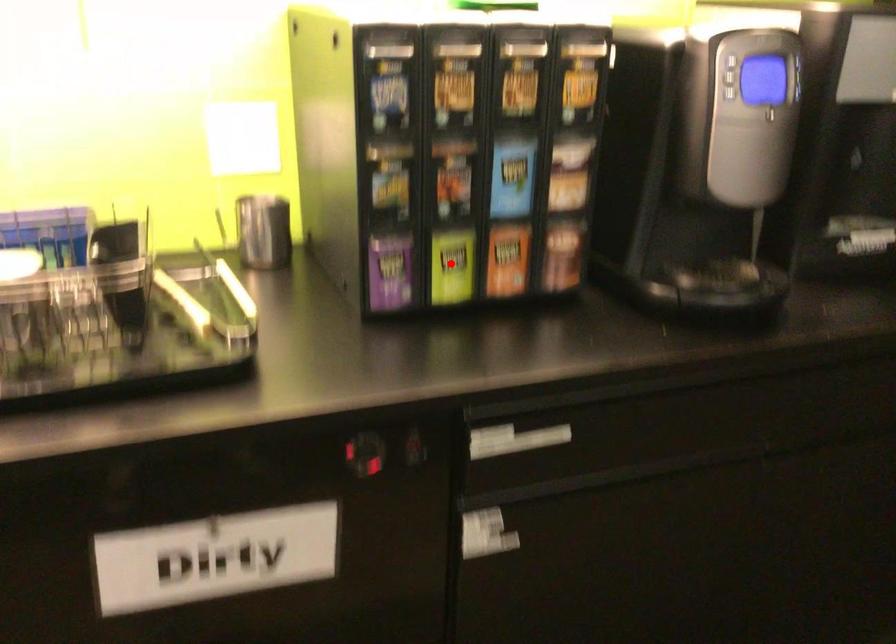
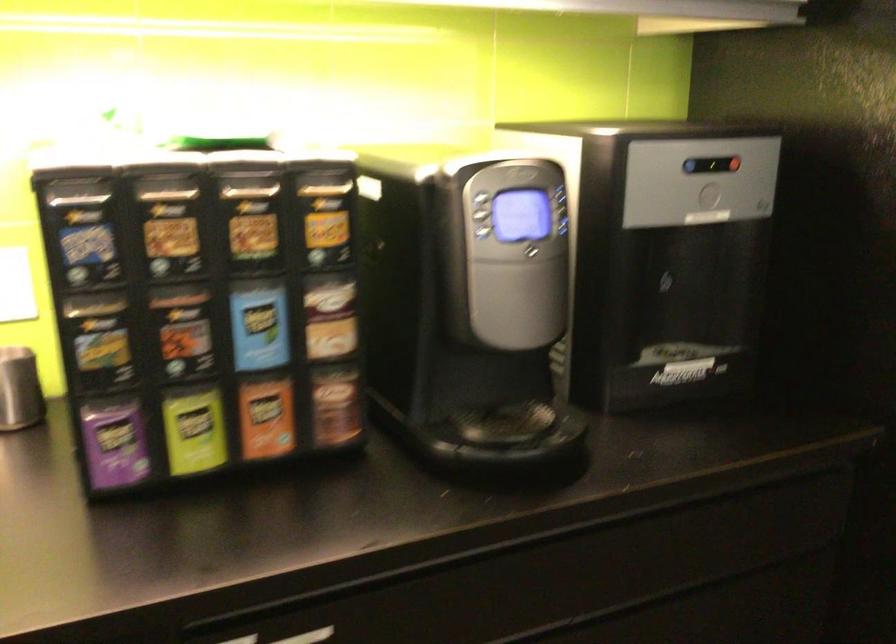
Question: I am providing you with two images of the same scene from different viewpoints. A red point is shown in image1. For the corresponding object point in image2, is it positioned nearer or farther from the camera?

Choices:
 (A) Nearer
 (B) Farther

Answer: (A)